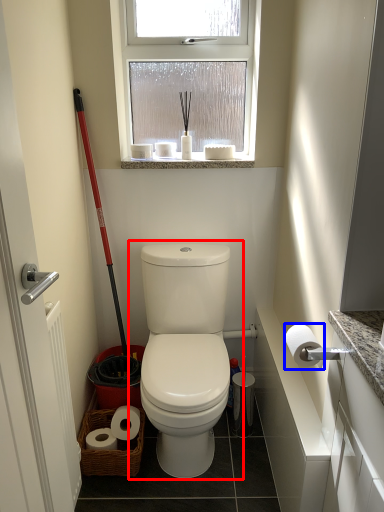
Question: Which object appears farthest to the camera in this image, toilet (highlighted by a red box) or toilet paper (highlighted by a blue box)?

Choices:
 (A) toilet
 (B) toilet paper

Answer: (A)